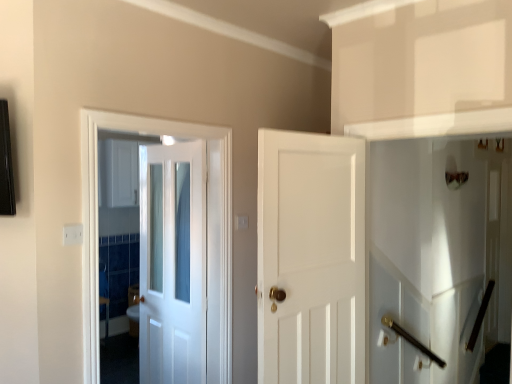
Question: Is white glossy door at center, the second door in the left-to-right sequence, positioned far away from polished brass door handle at lower right?

Choices:
 (A) no
 (B) yes

Answer: (B)

Question: From a real-world perspective, is white glossy door at center, the second door in the left-to-right sequence, on top of polished brass door handle at lower right?

Choices:
 (A) yes
 (B) no

Answer: (A)

Question: From the image's perspective, is white glossy door at center, the second door positioned from the right, over polished brass door handle at lower right?

Choices:
 (A) no
 (B) yes

Answer: (B)

Question: Could polished brass door handle at lower right be considered to be inside white glossy door at center, the second door in the left-to-right sequence?

Choices:
 (A) yes
 (B) no

Answer: (B)

Question: Does white glossy door at center, the second door positioned from the right, have a greater height compared to polished brass door handle at lower right?

Choices:
 (A) no
 (B) yes

Answer: (B)

Question: Considering the positions of polished brass door handle at lower right and white glossy cabinet at upper left in the image, is polished brass door handle at lower right wider or thinner than white glossy cabinet at upper left?

Choices:
 (A) thin
 (B) wide

Answer: (A)

Question: Is polished brass door handle at lower right inside or outside of white glossy cabinet at upper left?

Choices:
 (A) outside
 (B) inside

Answer: (A)

Question: Based on their positions, is polished brass door handle at lower right located to the left or right of white glossy cabinet at upper left?

Choices:
 (A) right
 (B) left

Answer: (A)

Question: From a real-world perspective, relative to white glossy cabinet at upper left, is polished brass door handle at lower right vertically above or below?

Choices:
 (A) below
 (B) above

Answer: (A)

Question: Considering the positions of white glossy door at center, which appears as the third door when viewed from the right, and white glossy elevator at right in the image, is white glossy door at center, which appears as the third door when viewed from the right, wider or thinner than white glossy elevator at right?

Choices:
 (A) thin
 (B) wide

Answer: (B)

Question: Considering the positions of point (153, 233) and point (504, 294), is point (153, 233) closer or farther from the camera than point (504, 294)?

Choices:
 (A) farther
 (B) closer

Answer: (B)

Question: From a real-world perspective, relative to white glossy elevator at right, is white glossy door at center, which appears as the third door when viewed from the right, vertically above or below?

Choices:
 (A) below
 (B) above

Answer: (A)

Question: Based on their positions, is white glossy door at center, positioned as the first door in left-to-right order, located to the left or right of white glossy elevator at right?

Choices:
 (A) left
 (B) right

Answer: (A)

Question: Considering the relative positions of white glossy cabinet at upper left and polished brass door handle at lower right in the image provided, is white glossy cabinet at upper left to the left or to the right of polished brass door handle at lower right?

Choices:
 (A) right
 (B) left

Answer: (B)

Question: Is white glossy cabinet at upper left taller or shorter than polished brass door handle at lower right?

Choices:
 (A) tall
 (B) short

Answer: (A)